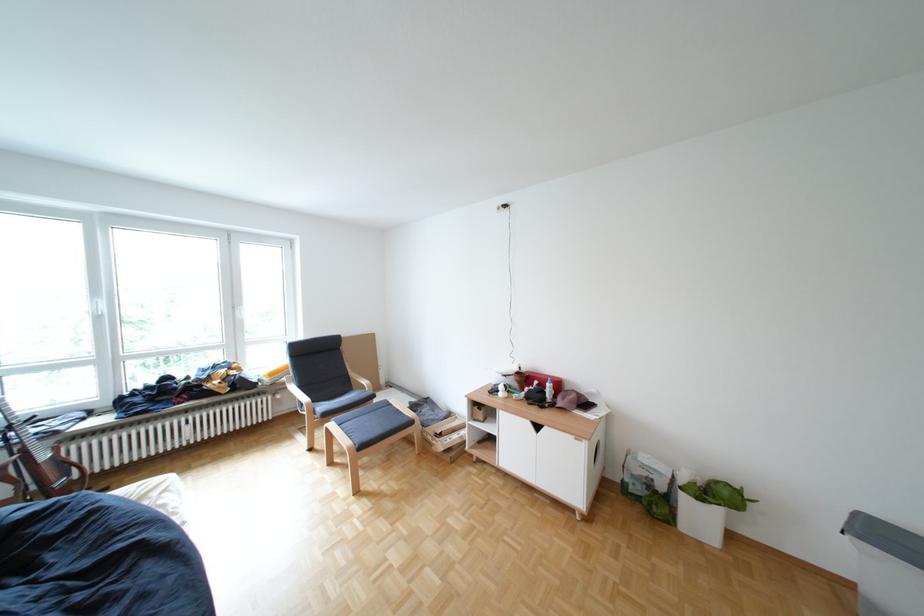
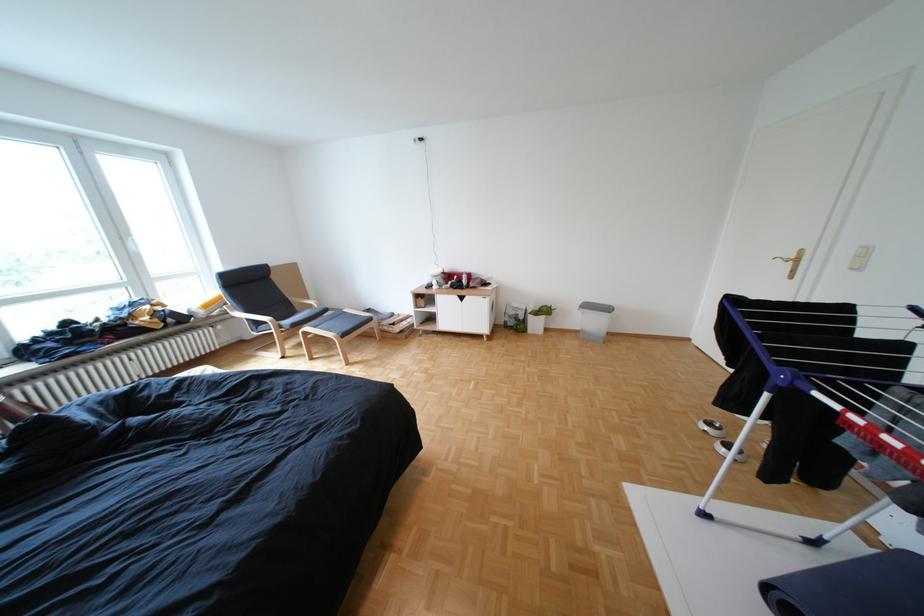
Locate, in the second image, the point that corresponds to (346,424) in the first image.

(322, 329)